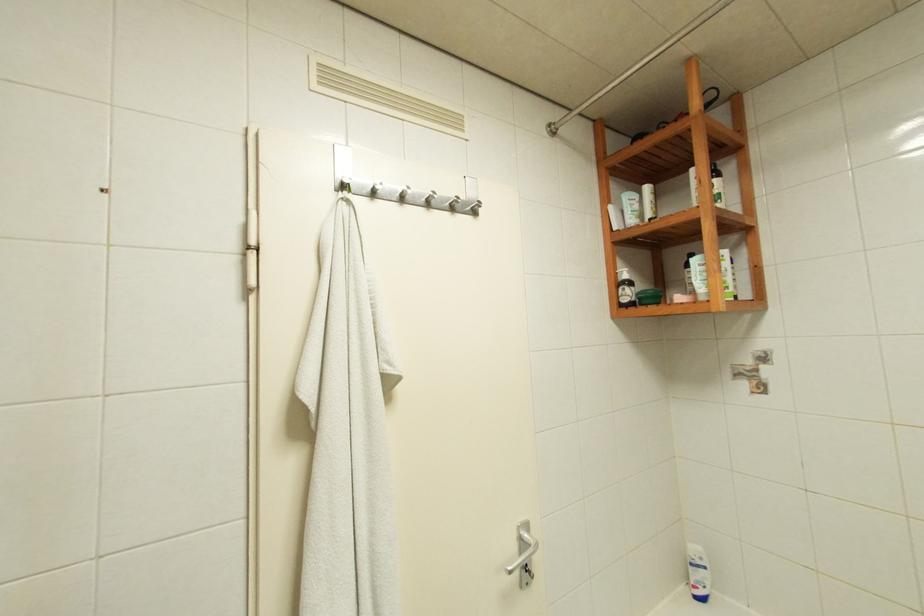
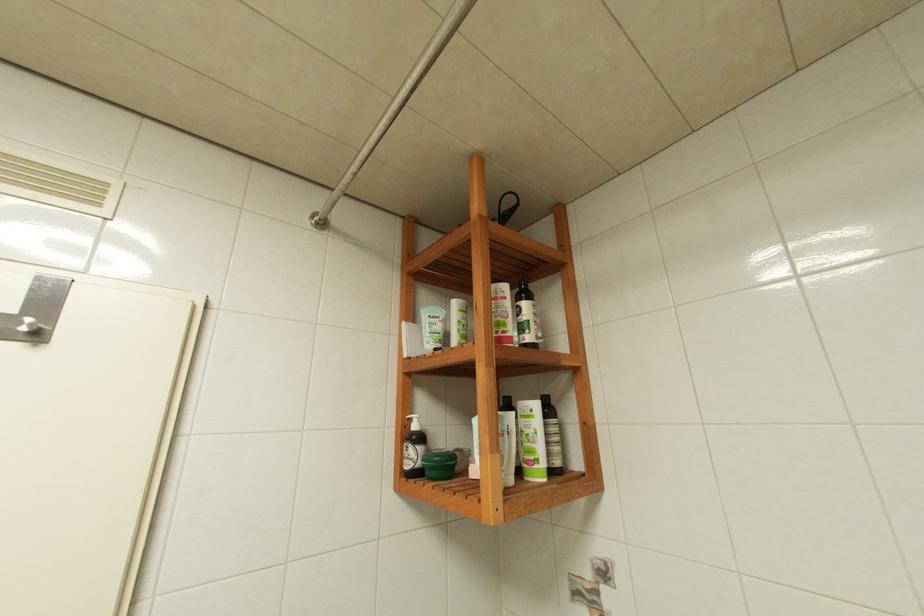
The images are taken continuously from a first-person perspective. In which direction are you moving?

The movement direction of the cameraman is right, forward.